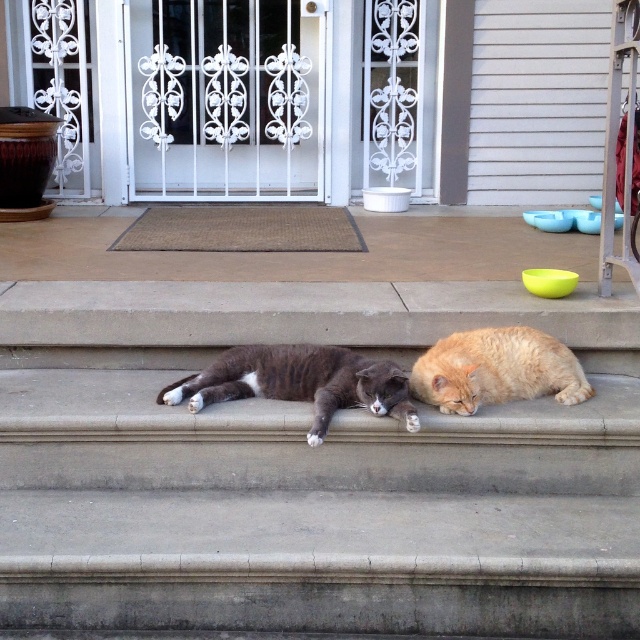
Question: Is gray striped cat at center to the right of orange fluffy cat at lower right from the viewer's perspective?

Choices:
 (A) yes
 (B) no

Answer: (B)

Question: Estimate the real-world distances between objects in this image. Which object is closer to the orange fluffy cat at lower right?

Choices:
 (A) concrete stairs at center
 (B) gray striped cat at center

Answer: (B)

Question: Can you confirm if concrete stairs at center is positioned below orange fluffy cat at lower right?

Choices:
 (A) yes
 (B) no

Answer: (A)

Question: Among these points, which one is farthest from the camera?

Choices:
 (A) (460, 408)
 (B) (241, 365)
 (C) (436, 528)

Answer: (B)

Question: Which point is closer to the camera?

Choices:
 (A) gray striped cat at center
 (B) concrete stairs at center

Answer: (B)

Question: Observing the image, what is the correct spatial positioning of concrete stairs at center in reference to orange fluffy cat at lower right?

Choices:
 (A) left
 (B) right

Answer: (A)